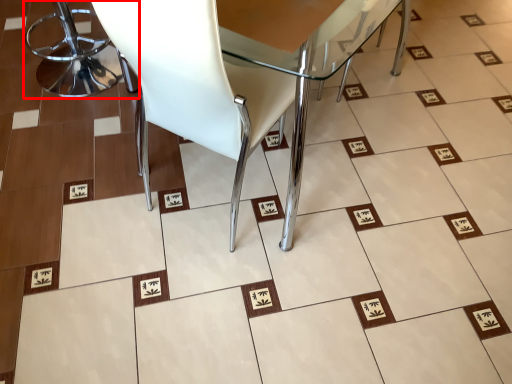
Question: From the image's perspective, where is chair (annotated by the red box) located in relation to chair in the image?

Choices:
 (A) below
 (B) above

Answer: (B)